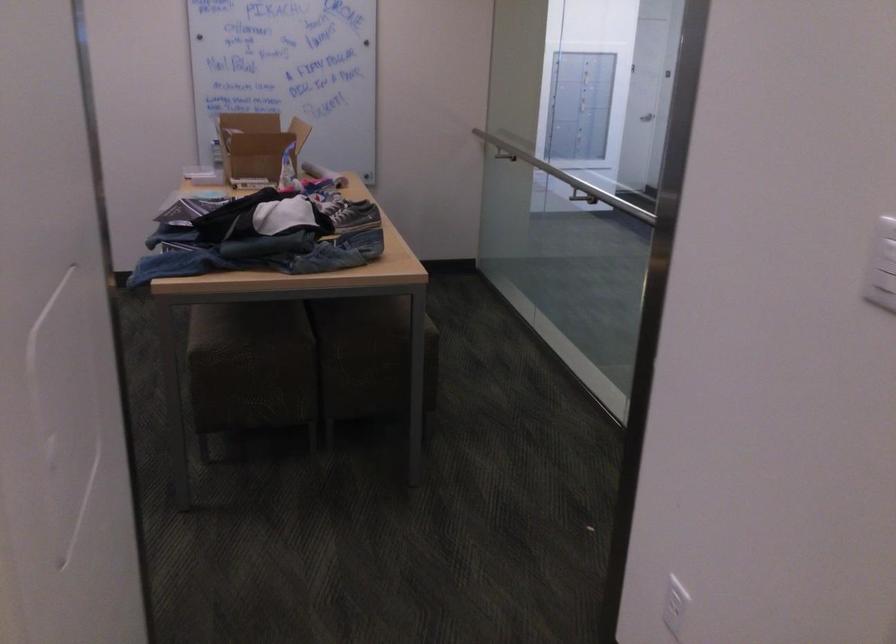
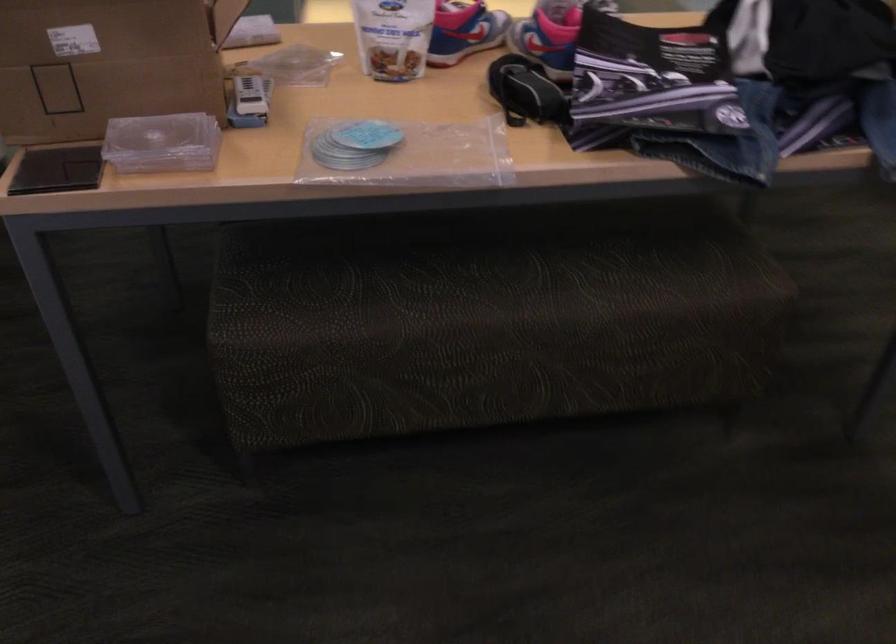
Where in the second image is the point corresponding to the point at 297,187 from the first image?

(463, 31)